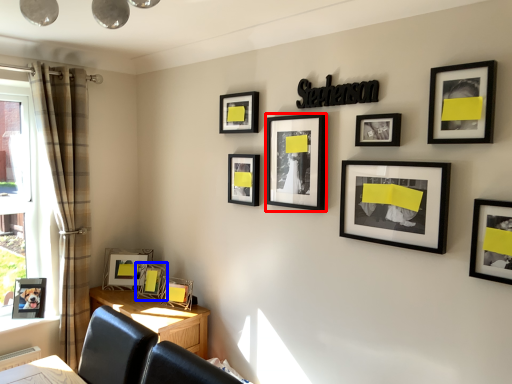
Question: Which point is further to the camera, picture frame (highlighted by a red box) or picture frame (highlighted by a blue box)?

Choices:
 (A) picture frame
 (B) picture frame

Answer: (B)